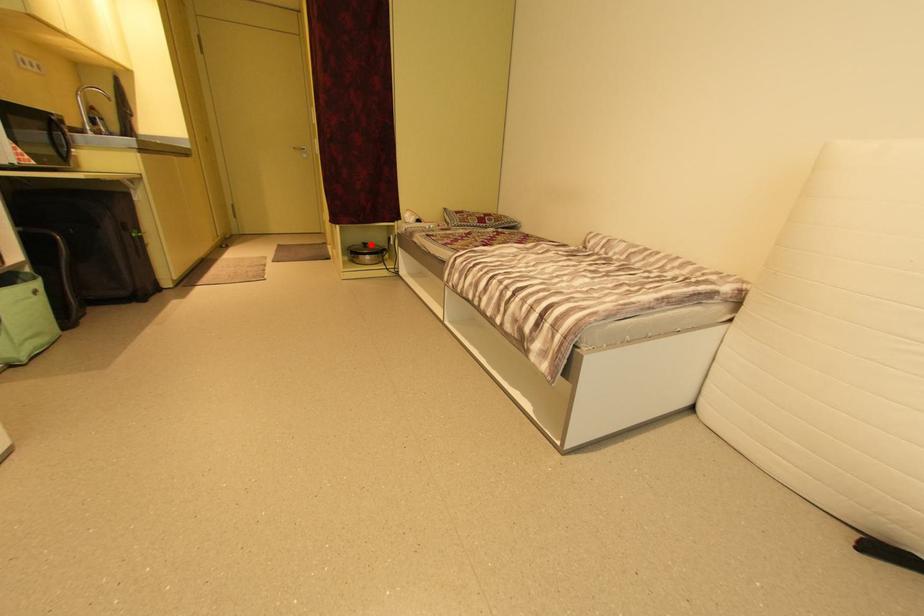
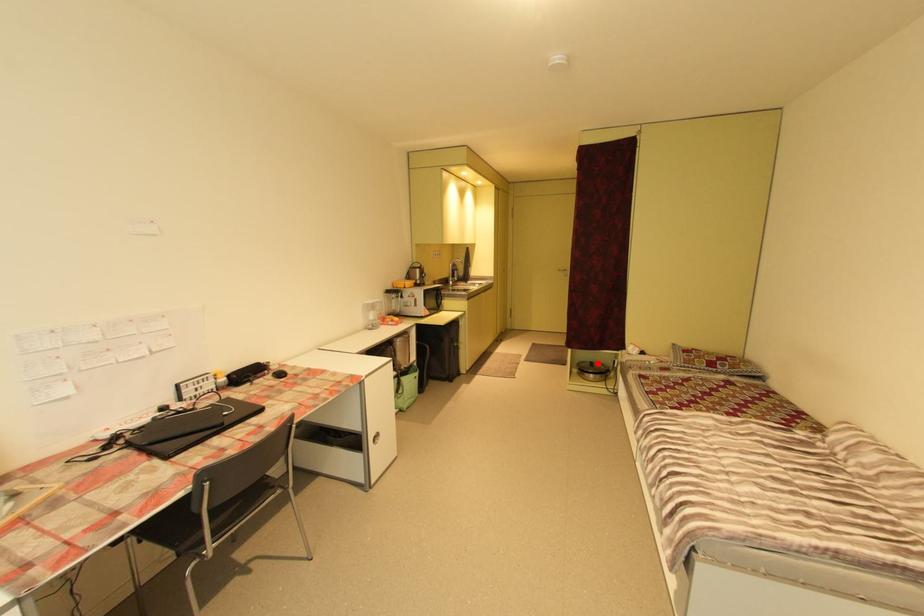
I am providing you with two images of the same scene from different viewpoints. A red point is marked on the first image and another point is marked on the second image. Is the marked point in image1 the same physical position as the marked point in image2?

Yes